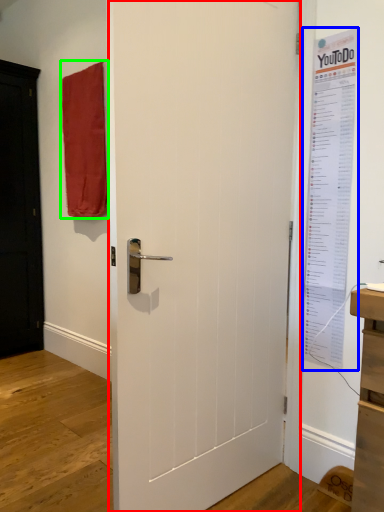
Question: Which object is the closest to the door (highlighted by a red box)? Choose among these: poster page (highlighted by a blue box) or curtain (highlighted by a green box).

Choices:
 (A) poster page
 (B) curtain

Answer: (A)